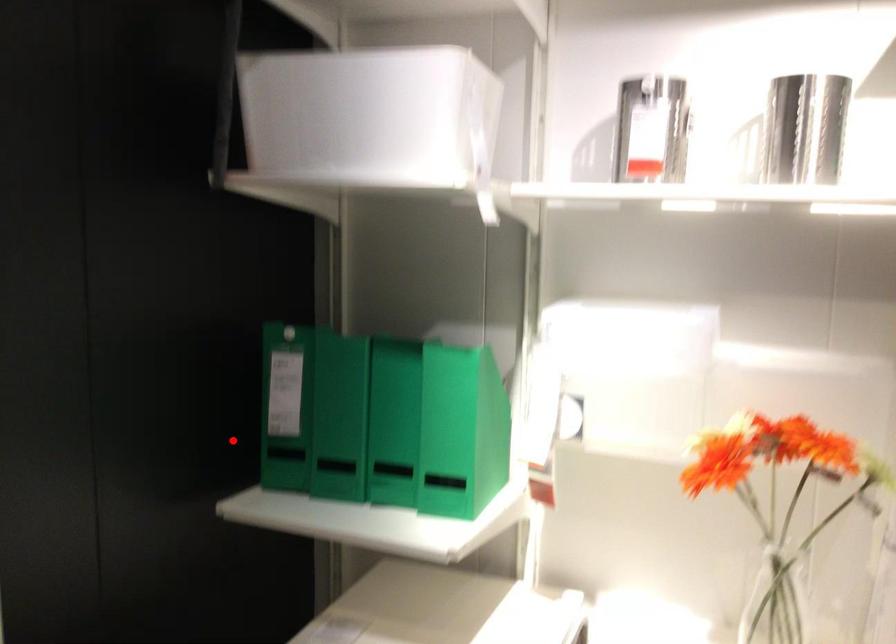
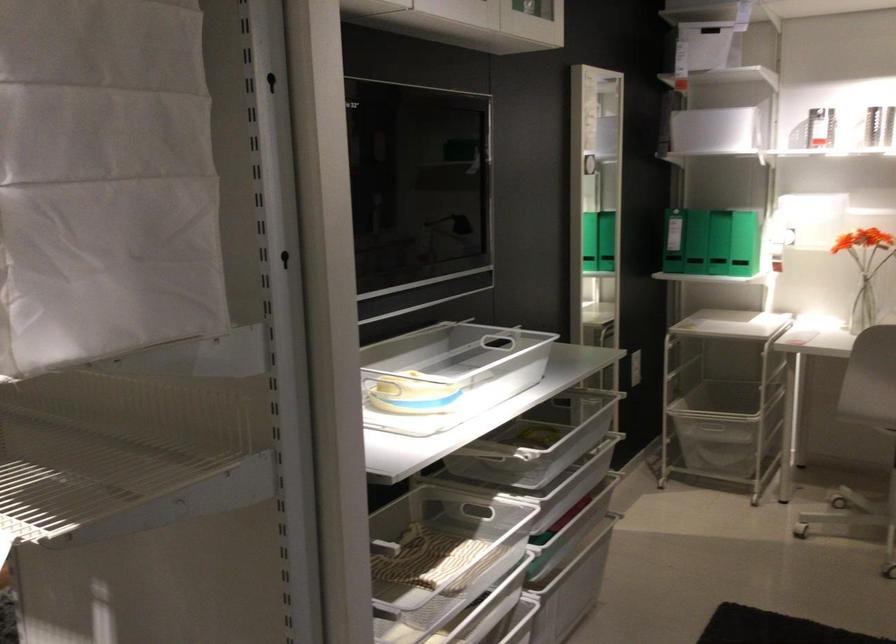
Question: I am providing you with two images of the same scene from different viewpoints. A red point is marked on the first image. At the location where the point appears in image 1, is it still visible in image 2?

Choices:
 (A) Yes
 (B) No

Answer: (A)